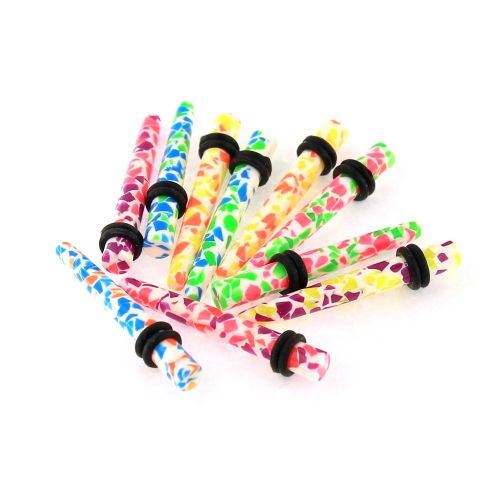
What are the coordinates of `green and blue plug` in the screenshot? It's located at (230, 213), (167, 158).